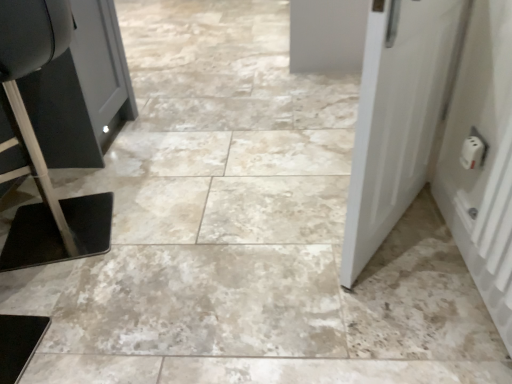
Question: Looking at the image, does white plastic door at right, arranged as the 2th door when viewed from the left, seem bigger or smaller compared to white matte door at right, positioned as the 2th door in right-to-left order?

Choices:
 (A) small
 (B) big

Answer: (A)

Question: From a real-world perspective, is white plastic door at right, arranged as the 2th door when viewed from the left, physically located above or below white matte door at right, positioned as the 2th door in right-to-left order?

Choices:
 (A) above
 (B) below

Answer: (A)

Question: Which object is positioned closest to the white plastic door at right, arranged as the 2th door when viewed from the left?

Choices:
 (A) white matte door at right, the first door in the left-to-right sequence
 (B) white plastic outlet at right

Answer: (B)

Question: Based on their relative distances, which object is farther from the white matte door at right, positioned as the 2th door in right-to-left order?

Choices:
 (A) white plastic door at right, arranged as the 2th door when viewed from the left
 (B) white plastic outlet at right

Answer: (B)